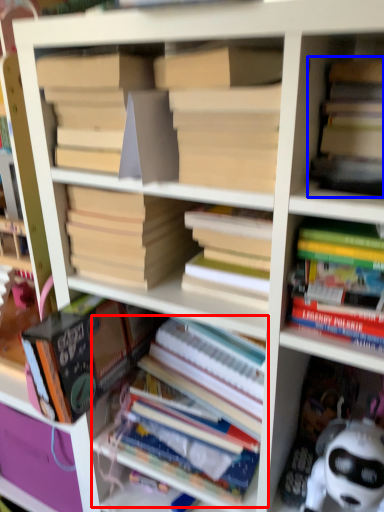
Question: Which point is further to the camera, book (highlighted by a red box) or book (highlighted by a blue box)?

Choices:
 (A) book
 (B) book

Answer: (A)